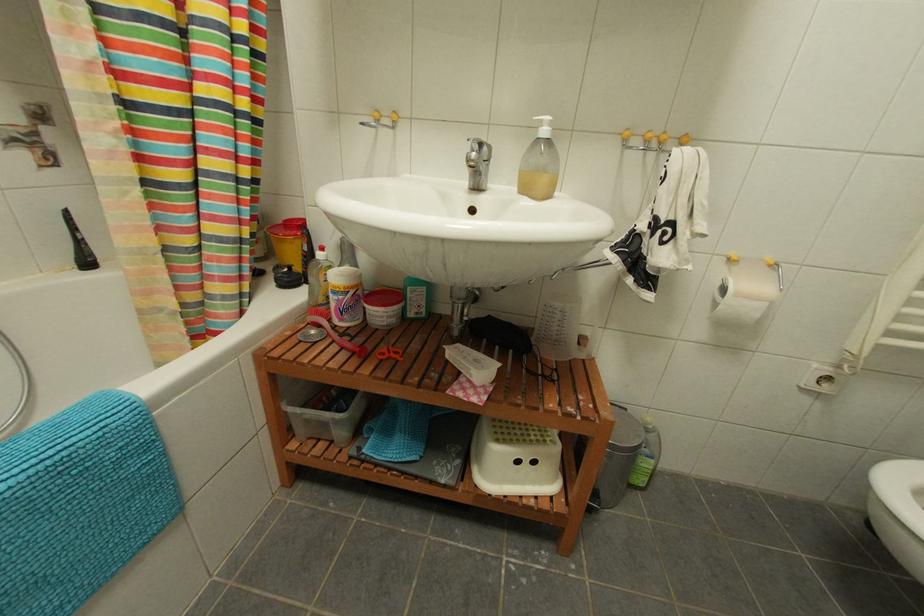
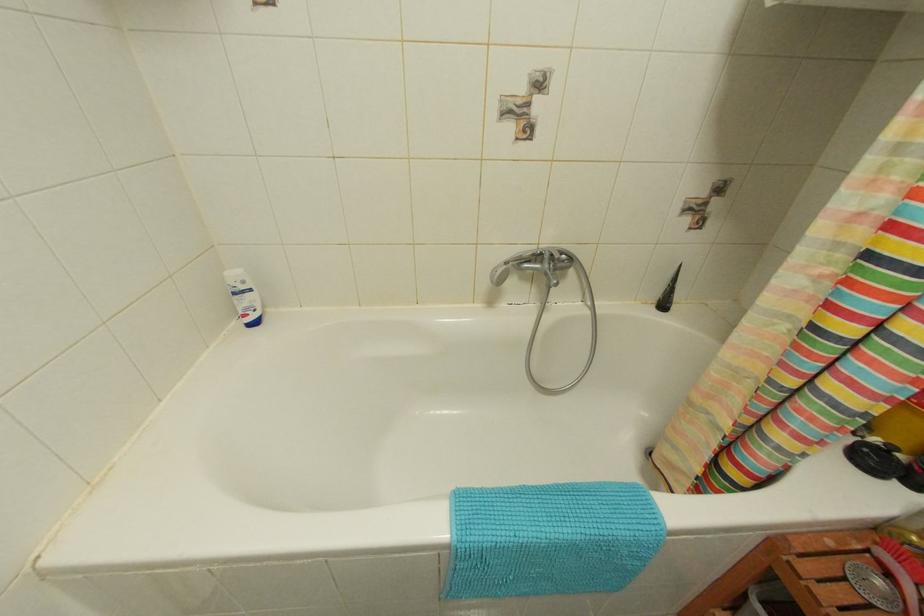
The first image is from the beginning of the video and the second image is from the end. How did the camera likely rotate when shooting the video?

The rotation direction of the camera is left-down.